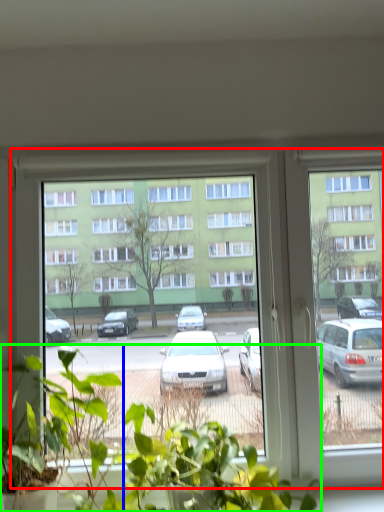
Question: Which object is the closest to the window (highlighted by a red box)? Choose among these: houseplant (highlighted by a blue box) or houseplant (highlighted by a green box).

Choices:
 (A) houseplant
 (B) houseplant

Answer: (B)